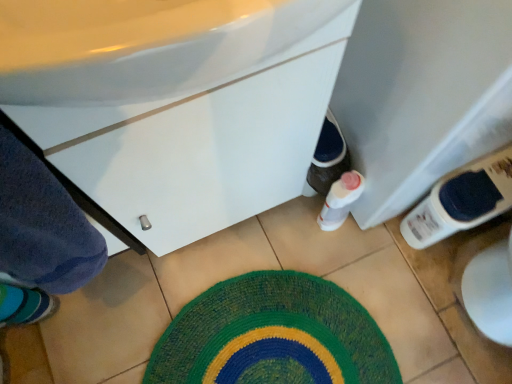
Question: Is knitted green bath mat at center aimed at white glossy cabinet at center?

Choices:
 (A) no
 (B) yes

Answer: (A)

Question: Can we say knitted green bath mat at center lies outside white glossy cabinet at center?

Choices:
 (A) no
 (B) yes

Answer: (B)

Question: Is knitted green bath mat at center to the left of white glossy cabinet at center from the viewer's perspective?

Choices:
 (A) no
 (B) yes

Answer: (A)

Question: Is knitted green bath mat at center surrounding white glossy cabinet at center?

Choices:
 (A) no
 (B) yes

Answer: (A)

Question: Considering the relative positions of knitted green bath mat at center and white glossy cabinet at center in the image provided, is knitted green bath mat at center to the right of white glossy cabinet at center from the viewer's perspective?

Choices:
 (A) no
 (B) yes

Answer: (B)

Question: Does knitted green bath mat at center have a greater width compared to white glossy cabinet at center?

Choices:
 (A) yes
 (B) no

Answer: (A)

Question: Does knitted green bath mat at center have a greater width compared to white plastic bottle at lower right?

Choices:
 (A) yes
 (B) no

Answer: (A)

Question: Does knitted green bath mat at center turn towards white plastic bottle at lower right?

Choices:
 (A) no
 (B) yes

Answer: (A)

Question: Is knitted green bath mat at center at the right side of white plastic bottle at lower right?

Choices:
 (A) yes
 (B) no

Answer: (B)

Question: From the image's perspective, would you say knitted green bath mat at center is shown under white plastic bottle at lower right?

Choices:
 (A) yes
 (B) no

Answer: (A)

Question: From the image's perspective, is knitted green bath mat at center on white plastic bottle at lower right?

Choices:
 (A) yes
 (B) no

Answer: (B)

Question: Is knitted green bath mat at center oriented away from white plastic bottle at lower right?

Choices:
 (A) no
 (B) yes

Answer: (A)

Question: From the image's perspective, is white glossy cabinet at center under knitted green bath mat at center?

Choices:
 (A) yes
 (B) no

Answer: (B)